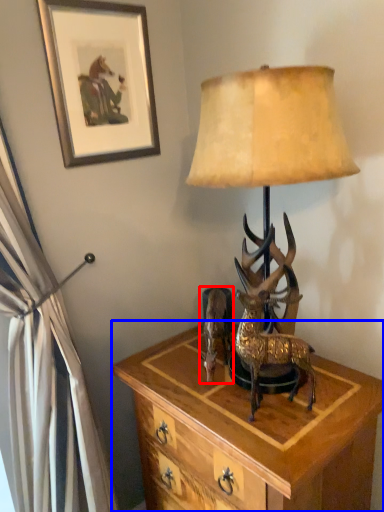
Question: Which object is closer to the camera taking this photo, reindeer (highlighted by a red box) or nightstand (highlighted by a blue box)?

Choices:
 (A) reindeer
 (B) nightstand

Answer: (B)